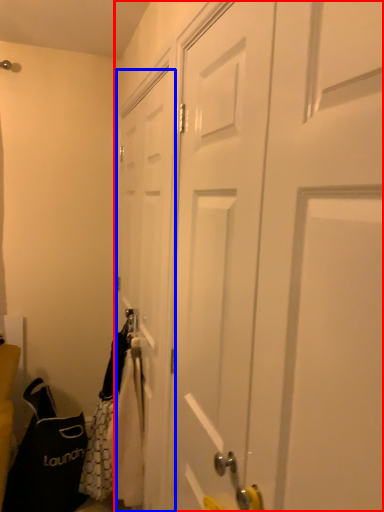
Question: Which of the following is the closest to the observer, door (highlighted by a red box) or door (highlighted by a blue box)?

Choices:
 (A) door
 (B) door

Answer: (A)